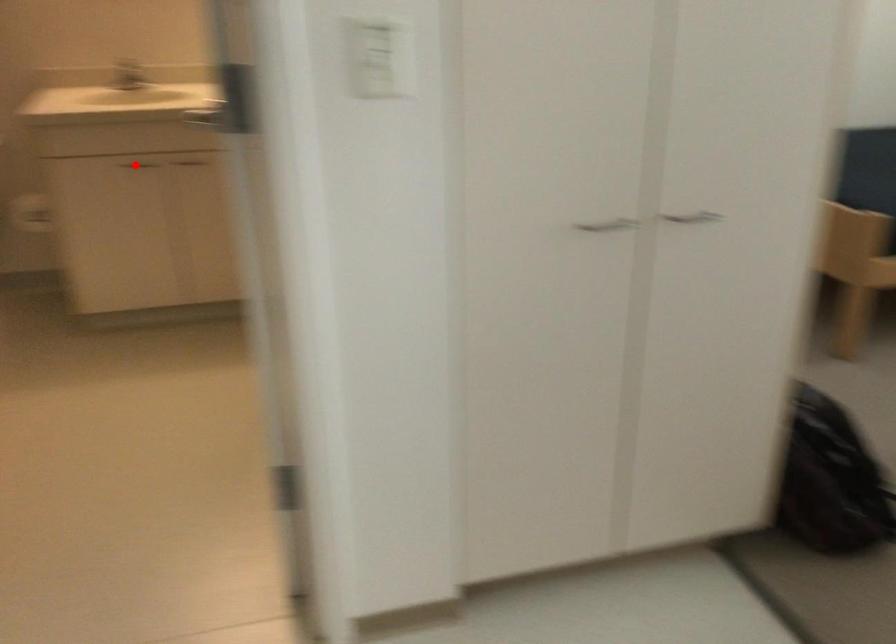
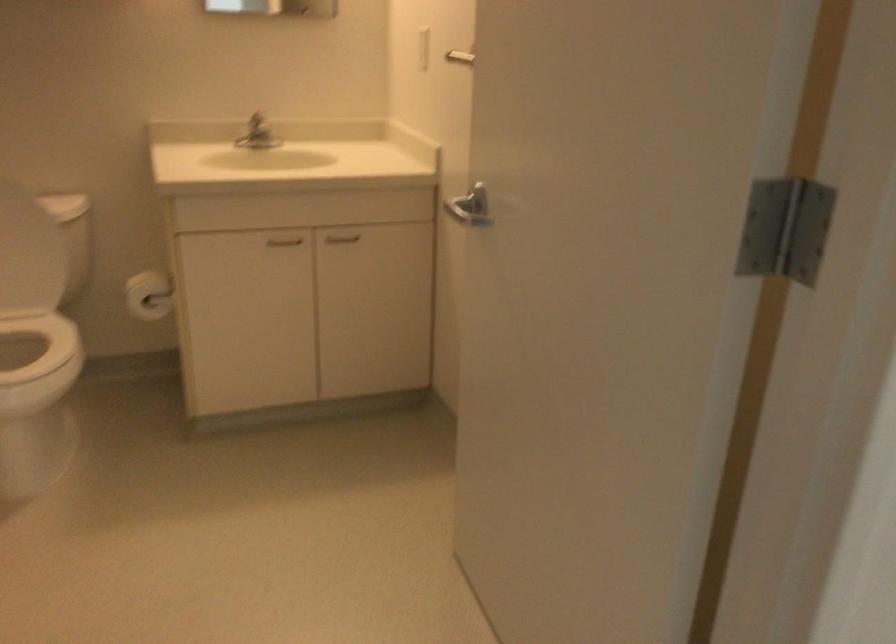
Question: I am providing you with two images of the same scene from different viewpoints. In image1, a red point is highlighted. Considering the same 3D point in image2, which of the following is correct?

Choices:
 (A) It is closer
 (B) It is farther

Answer: (A)